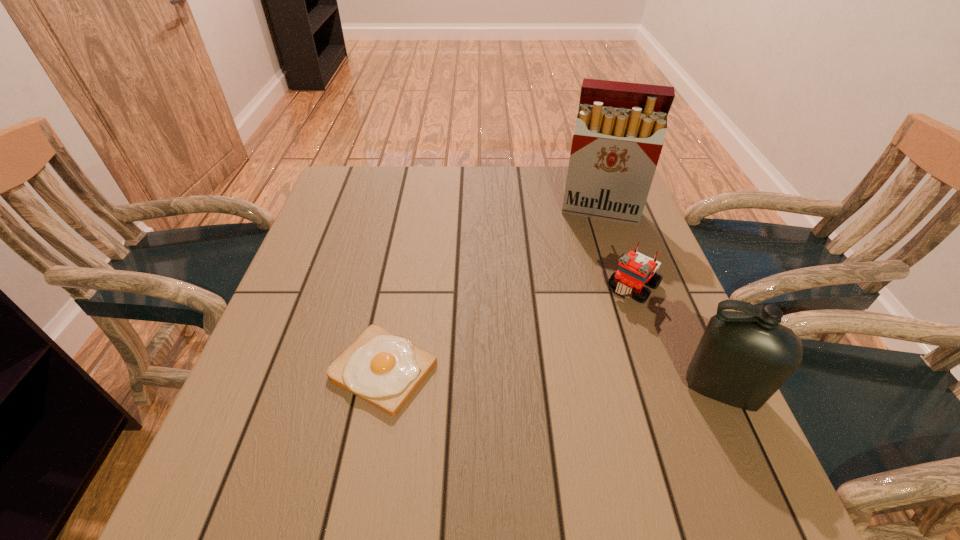
Where is `the shortest object`? Image resolution: width=960 pixels, height=540 pixels. the shortest object is located at coordinates (383, 369).

The image size is (960, 540). I want to click on toast, so click(x=383, y=369).

Locate an element on the screen. The width and height of the screenshot is (960, 540). bottle is located at coordinates (743, 358).

The height and width of the screenshot is (540, 960). In order to click on cigarette case in this screenshot , I will do pos(620,127).

You are a GUI agent. You are given a task and a screenshot of the screen. Output one action in this format:
    pyautogui.click(x=<x>, y=<y>)
    Task: Click on the tallest object
    The width and height of the screenshot is (960, 540).
    Given the screenshot: What is the action you would take?
    pyautogui.click(x=620, y=127)

Locate an element on the screen. the second shortest object is located at coordinates (635, 269).

Image resolution: width=960 pixels, height=540 pixels. What are the coordinates of `the second farthest object` in the screenshot? It's located at (635, 269).

The height and width of the screenshot is (540, 960). Identify the location of vacant space located on the left of the toast. (289, 370).

This screenshot has height=540, width=960. Identify the location of vacant space located 0.200m on the left of the bottle. (576, 390).

Identify the location of vacant space located with the lid open on the cigarette case. Image resolution: width=960 pixels, height=540 pixels. (581, 324).